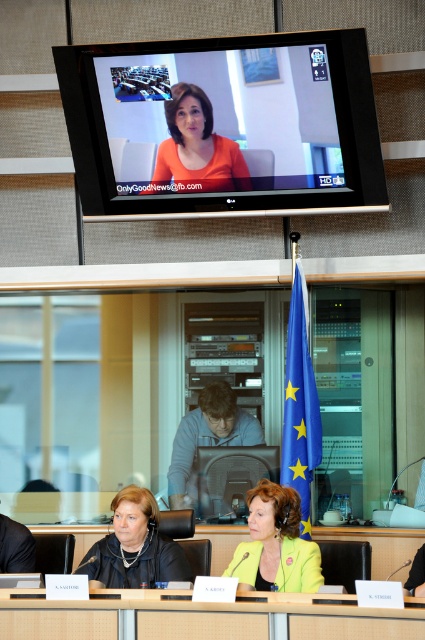
Question: Which point is closer to the camera taking this photo?

Choices:
 (A) (155, 65)
 (B) (249, 550)
 (C) (22, 600)
 (D) (164, 144)

Answer: (C)

Question: Can you confirm if wooden table at center is positioned to the left of orange matte shirt at upper center?

Choices:
 (A) yes
 (B) no

Answer: (B)

Question: Does matte black monitor at upper center appear under light gray fabric at center?

Choices:
 (A) no
 (B) yes

Answer: (A)

Question: Which of the following is the farthest from the observer?

Choices:
 (A) orange matte shirt at upper center
 (B) wooden table at center
 (C) matte black monitor at upper center
 (D) light gray fabric at center

Answer: (D)

Question: Which object is the closest to the orange matte shirt at upper center?

Choices:
 (A) light gray fabric at center
 (B) yellowpolyestereuropean union flag at center
 (C) matte black monitor at upper center
 (D) matte black chair at lower left

Answer: (C)

Question: From the image, what is the correct spatial relationship of light gray fabric at center in relation to matte black chair at lower left?

Choices:
 (A) above
 (B) below

Answer: (A)